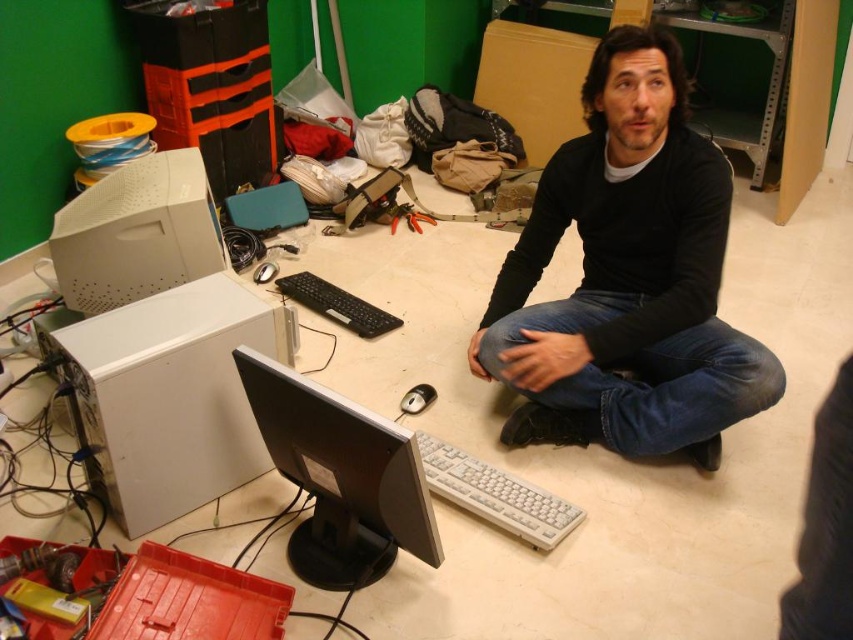
Can you confirm if black matte shirt at center is thinner than white plastic desktop computer at left?

Incorrect, black matte shirt at center's width is not less than white plastic desktop computer at left's.

From the picture: Who is taller, black matte shirt at center or white plastic desktop computer at left?

black matte shirt at center is taller.

Is point (612, 36) closer to viewer compared to point (85, 246)?

Yes.

At what (x,y) coordinates should I click in order to perform the action: click on black matte shirt at center. Please return your answer as a coordinate pair (x, y). The width and height of the screenshot is (853, 640). Looking at the image, I should click on (627, 276).

Is the position of white plastic computer case at lower left less distant than that of white plastic keyboard at lower center?

Yes, white plastic computer case at lower left is in front of white plastic keyboard at lower center.

Can you confirm if white plastic computer case at lower left is taller than white plastic keyboard at lower center?

Yes, white plastic computer case at lower left is taller than white plastic keyboard at lower center.

Is point (163, 340) farther from camera compared to point (546, 502)?

No, it is not.

At what (x,y) coordinates should I click in order to perform the action: click on white plastic computer case at lower left. Please return your answer as a coordinate pair (x, y). The image size is (853, 640). Looking at the image, I should click on pyautogui.click(x=172, y=396).

Is white plastic desktop computer at left to the right of white plastic keyboard at lower center from the viewer's perspective?

No, white plastic desktop computer at left is not to the right of white plastic keyboard at lower center.

Between point (143, 269) and point (544, 497), which one is positioned in front?

Point (544, 497) is more forward.

You are a GUI agent. You are given a task and a screenshot of the screen. Output one action in this format:
    pyautogui.click(x=<x>, y=<y>)
    Task: Click on the white plastic desktop computer at left
    
    Given the screenshot: What is the action you would take?
    pyautogui.click(x=136, y=234)